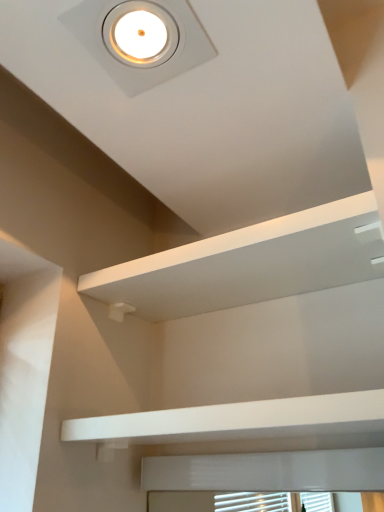
Question: Considering the relative sizes of white matte/finish balustrade at lower center and white matte shelf at upper center in the image provided, is white matte/finish balustrade at lower center smaller than white matte shelf at upper center?

Choices:
 (A) no
 (B) yes

Answer: (B)

Question: Are white matte/finish balustrade at lower center and white matte shelf at upper center making contact?

Choices:
 (A) no
 (B) yes

Answer: (A)

Question: Is white matte/finish balustrade at lower center looking in the opposite direction of white matte shelf at upper center?

Choices:
 (A) no
 (B) yes

Answer: (A)

Question: Is white matte/finish balustrade at lower center positioned in front of white matte shelf at upper center?

Choices:
 (A) yes
 (B) no

Answer: (A)

Question: Does white matte/finish balustrade at lower center have a greater height compared to white matte shelf at upper center?

Choices:
 (A) yes
 (B) no

Answer: (B)

Question: Is white matte shelf at upper center inside white matte/finish balustrade at lower center?

Choices:
 (A) yes
 (B) no

Answer: (B)

Question: Are white glossy droplight at upper center and white matte/finish balustrade at lower center located far from each other?

Choices:
 (A) no
 (B) yes

Answer: (A)

Question: From a real-world perspective, is white glossy droplight at upper center beneath white matte/finish balustrade at lower center?

Choices:
 (A) yes
 (B) no

Answer: (B)

Question: Is white glossy droplight at upper center located outside white matte/finish balustrade at lower center?

Choices:
 (A) no
 (B) yes

Answer: (B)

Question: Is white glossy droplight at upper center thinner than white matte/finish balustrade at lower center?

Choices:
 (A) yes
 (B) no

Answer: (A)

Question: Are white glossy droplight at upper center and white matte/finish balustrade at lower center making contact?

Choices:
 (A) no
 (B) yes

Answer: (A)

Question: Considering the relative sizes of white glossy droplight at upper center and white matte/finish balustrade at lower center in the image provided, is white glossy droplight at upper center taller than white matte/finish balustrade at lower center?

Choices:
 (A) no
 (B) yes

Answer: (A)

Question: Is white matte/finish balustrade at lower center beside white glossy droplight at upper center?

Choices:
 (A) yes
 (B) no

Answer: (B)